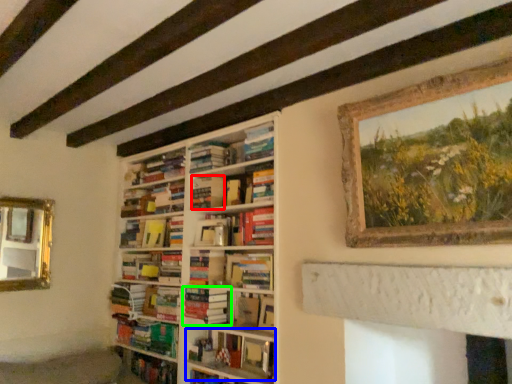
Question: Which is farther away from paperback book (highlighted by a red box)? book (highlighted by a blue box) or book (highlighted by a green box)?

Choices:
 (A) book
 (B) book

Answer: (A)